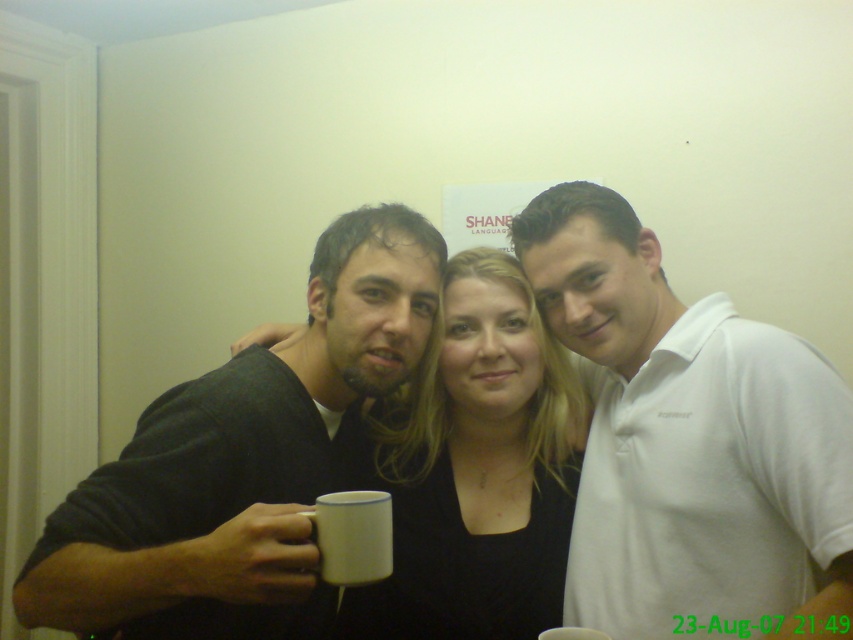
Is white cotton polo shirt at center positioned at the back of white ceramic mug at center?

Yes.

Is white cotton polo shirt at center to the left of white ceramic mug at center from the viewer's perspective?

Incorrect, white cotton polo shirt at center is not on the left side of white ceramic mug at center.

Where is `white cotton polo shirt at center`? The image size is (853, 640). white cotton polo shirt at center is located at coordinates (688, 436).

This screenshot has height=640, width=853. I want to click on white cotton polo shirt at center, so click(x=688, y=436).

Can you confirm if matte black shirt at center is positioned to the left of white ceramic mug at center?

Indeed, matte black shirt at center is positioned on the left side of white ceramic mug at center.

Is matte black shirt at center to the right of white ceramic mug at center from the viewer's perspective?

No, matte black shirt at center is not to the right of white ceramic mug at center.

Locate an element on the screen. matte black shirt at center is located at coordinates (241, 460).

Where is `matte black shirt at center`? This screenshot has height=640, width=853. matte black shirt at center is located at coordinates (241, 460).

Does point (253, 532) come in front of point (345, 525)?

Yes, point (253, 532) is in front of point (345, 525).

Does white matte mug at center appear on the left side of white enamel mug at lower left?

Incorrect, white matte mug at center is not on the left side of white enamel mug at lower left.

Locate an element on the screen. white matte mug at center is located at coordinates (596, 276).